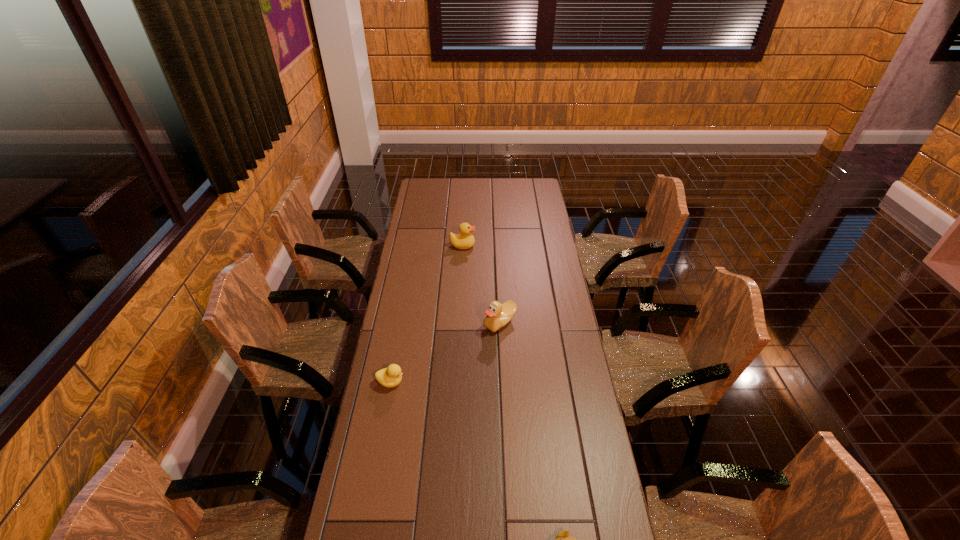
Find the location of a particular element. the farthest object is located at coordinates (466, 240).

Identify the location of the farthest duck. (466, 240).

Identify the location of the second nearest duck. The image size is (960, 540). pos(498,315).

The image size is (960, 540). I want to click on the second object from right to left, so click(x=498, y=315).

This screenshot has width=960, height=540. Identify the location of the leftmost object. tap(391, 376).

You are a GUI agent. You are given a task and a screenshot of the screen. Output one action in this format:
    pyautogui.click(x=<x>, y=<y>)
    Task: Click on the nearest duck
    
    Given the screenshot: What is the action you would take?
    pyautogui.click(x=391, y=376)

Find the location of a particular element. free region located 0.140m at the beak of the farthest object is located at coordinates (504, 246).

This screenshot has height=540, width=960. Find the location of `vacant space located 0.370m at the beak of the third nearest object`. vacant space located 0.370m at the beak of the third nearest object is located at coordinates (390, 322).

I want to click on vacant space located 0.370m at the beak of the third nearest object, so click(390, 322).

You are a GUI agent. You are given a task and a screenshot of the screen. Output one action in this format:
    pyautogui.click(x=<x>, y=<y>)
    Task: Click on the vacant space located 0.190m at the beak of the third nearest object
    Image resolution: width=960 pixels, height=540 pixels.
    Given the screenshot: What is the action you would take?
    pyautogui.click(x=435, y=322)